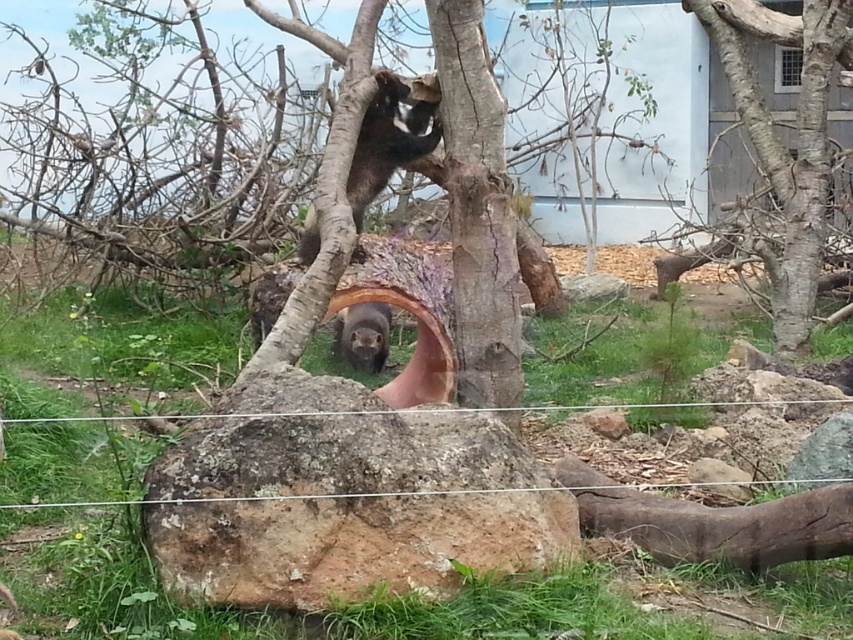
Does smooth bark tree trunk at center appear under brown rough tree at right?

Yes.

Is smooth bark tree trunk at center bigger than brown rough tree at right?

No, smooth bark tree trunk at center is not bigger than brown rough tree at right.

The height and width of the screenshot is (640, 853). What are the coordinates of `smooth bark tree trunk at center` in the screenshot? It's located at (477, 209).

Does wire mesh at center have a greater height compared to brown rough tree at right?

Incorrect, wire mesh at center's height is not larger of brown rough tree at right's.

Can you confirm if wire mesh at center is smaller than brown rough tree at right?

Incorrect, wire mesh at center is not smaller in size than brown rough tree at right.

Measure the distance between wire mesh at center and camera.

A distance of 1.82 meters exists between wire mesh at center and camera.

I want to click on wire mesh at center, so [503, 611].

Is wire mesh at center taller than furry brown otter at center?

Correct, wire mesh at center is much taller as furry brown otter at center.

Between wire mesh at center and furry brown otter at center, which one has more height?

wire mesh at center is taller.

Does point (99, 596) lie behind point (357, 314)?

No, (99, 596) is closer to viewer.

The width and height of the screenshot is (853, 640). In order to click on wire mesh at center in this screenshot , I will do `click(503, 611)`.